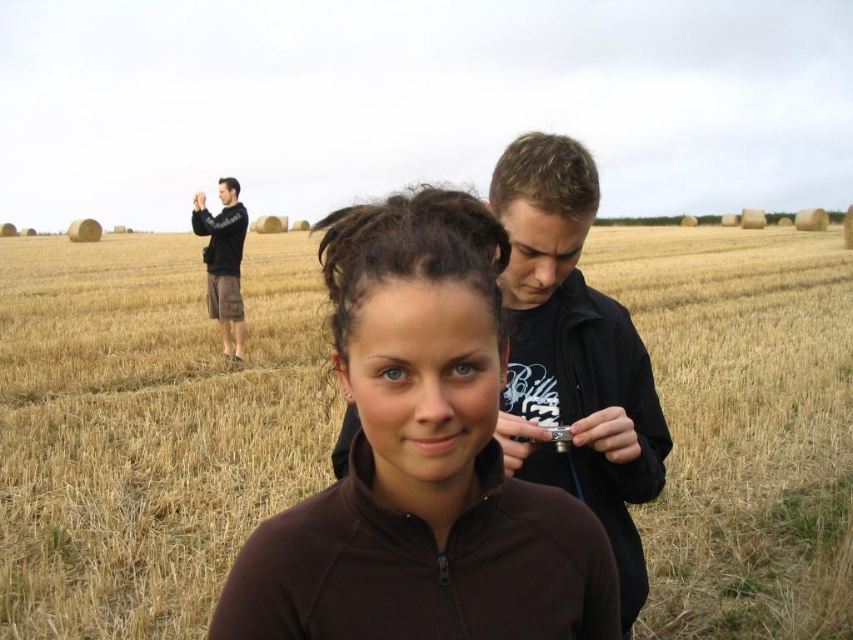
Who is lower down, black matte jacket at center or black cotton shorts at left?

black matte jacket at center

Is black matte jacket at center further to camera compared to black cotton shorts at left?

No.

Which is behind, point (519, 166) or point (222, 186)?

Positioned behind is point (222, 186).

The height and width of the screenshot is (640, 853). In order to click on black matte jacket at center in this screenshot , I will do `click(573, 355)`.

Can you confirm if yellow straw field at center is shorter than black matte jacket at center?

No.

The height and width of the screenshot is (640, 853). Describe the element at coordinates (144, 428) in the screenshot. I see `yellow straw field at center` at that location.

What do you see at coordinates (144, 428) in the screenshot? The image size is (853, 640). I see `yellow straw field at center` at bounding box center [144, 428].

Identify the location of yellow straw field at center. The height and width of the screenshot is (640, 853). (144, 428).

Which is above, brown fleece jacket at center or black matte jacket at center?

black matte jacket at center is higher up.

Can you confirm if brown fleece jacket at center is wider than black matte jacket at center?

Indeed, brown fleece jacket at center has a greater width compared to black matte jacket at center.

Between point (386, 449) and point (514, 237), which one is positioned in front?

Positioned in front is point (386, 449).

Locate an element on the screen. The width and height of the screenshot is (853, 640). brown fleece jacket at center is located at coordinates (421, 461).